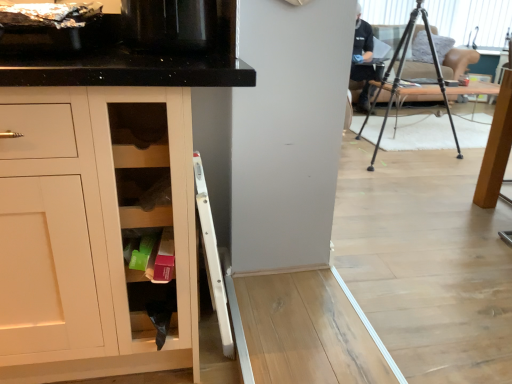
Question: From the image's perspective, is wooden shelves at lower center over light brown wooden table at right?

Choices:
 (A) yes
 (B) no

Answer: (B)

Question: Is wooden shelves at lower center further to the viewer compared to light brown wooden table at right?

Choices:
 (A) no
 (B) yes

Answer: (A)

Question: Is light brown wooden table at right completely or partially inside wooden shelves at lower center?

Choices:
 (A) yes
 (B) no

Answer: (B)

Question: Does wooden shelves at lower center touch light brown wooden table at right?

Choices:
 (A) no
 (B) yes

Answer: (A)

Question: Can you confirm if wooden shelves at lower center is thinner than light brown wooden table at right?

Choices:
 (A) no
 (B) yes

Answer: (B)

Question: Is light brown wooden table at right at the back of wooden shelves at lower center?

Choices:
 (A) no
 (B) yes

Answer: (A)

Question: Does light brown wooden table at right lie in front of wooden shelves at lower center?

Choices:
 (A) no
 (B) yes

Answer: (A)

Question: From a real-world perspective, is light brown wooden table at right on top of wooden shelves at lower center?

Choices:
 (A) yes
 (B) no

Answer: (B)

Question: Does light brown wooden table at right have a lesser width compared to wooden shelves at lower center?

Choices:
 (A) no
 (B) yes

Answer: (A)

Question: Can you confirm if light brown wooden table at right is shorter than wooden shelves at lower center?

Choices:
 (A) no
 (B) yes

Answer: (A)

Question: Is the depth of light brown wooden table at right greater than that of wooden shelves at lower center?

Choices:
 (A) yes
 (B) no

Answer: (A)

Question: Considering the relative sizes of light brown wooden table at right and wooden shelves at lower center in the image provided, is light brown wooden table at right taller than wooden shelves at lower center?

Choices:
 (A) yes
 (B) no

Answer: (A)

Question: From a real-world perspective, is black glossy microwave at upper left physically above light brown wooden table at right?

Choices:
 (A) yes
 (B) no

Answer: (A)